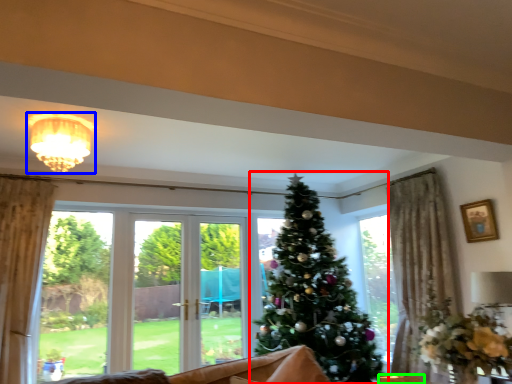
Question: Based on their relative distances, which object is nearer to christmas tree (highlighted by a red box)? Choose from light fixture (highlighted by a blue box) and furniture (highlighted by a green box).

Choices:
 (A) light fixture
 (B) furniture

Answer: (B)